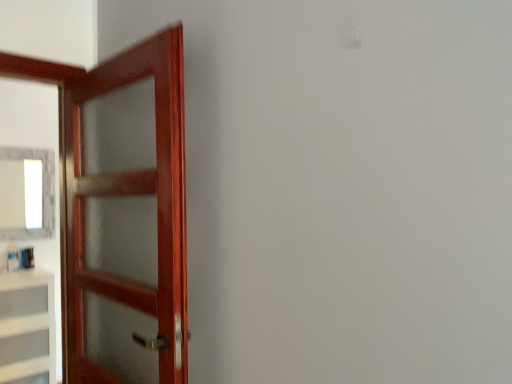
Question: Is white matte cabinet at left positioned beyond the bounds of mahogany wood door at left?

Choices:
 (A) no
 (B) yes

Answer: (B)

Question: Can you confirm if white matte cabinet at left is bigger than mahogany wood door at left?

Choices:
 (A) no
 (B) yes

Answer: (B)

Question: From a real-world perspective, is white matte cabinet at left below mahogany wood door at left?

Choices:
 (A) no
 (B) yes

Answer: (B)

Question: Is white matte cabinet at left taller than mahogany wood door at left?

Choices:
 (A) no
 (B) yes

Answer: (A)

Question: Is white matte cabinet at left positioned behind mahogany wood door at left?

Choices:
 (A) no
 (B) yes

Answer: (B)

Question: Is white matte cabinet at left oriented away from mahogany wood door at left?

Choices:
 (A) yes
 (B) no

Answer: (B)

Question: From a real-world perspective, is mahogany wood door at left positioned over white matte cabinet at left based on gravity?

Choices:
 (A) yes
 (B) no

Answer: (A)

Question: Is the position of mahogany wood door at left less distant than that of white matte cabinet at left?

Choices:
 (A) no
 (B) yes

Answer: (B)

Question: Does mahogany wood door at left have a larger size compared to white matte cabinet at left?

Choices:
 (A) no
 (B) yes

Answer: (A)

Question: Is there a large distance between mahogany wood door at left and white matte cabinet at left?

Choices:
 (A) no
 (B) yes

Answer: (B)

Question: Is mahogany wood door at left turned away from white matte cabinet at left?

Choices:
 (A) yes
 (B) no

Answer: (B)

Question: Is white matte cabinet at left inside mahogany wood door at left?

Choices:
 (A) no
 (B) yes

Answer: (A)

Question: Considering the relative positions of white glossy mirror at upper left and mahogany wood door at left in the image provided, is white glossy mirror at upper left to the left of mahogany wood door at left from the viewer's perspective?

Choices:
 (A) yes
 (B) no

Answer: (A)